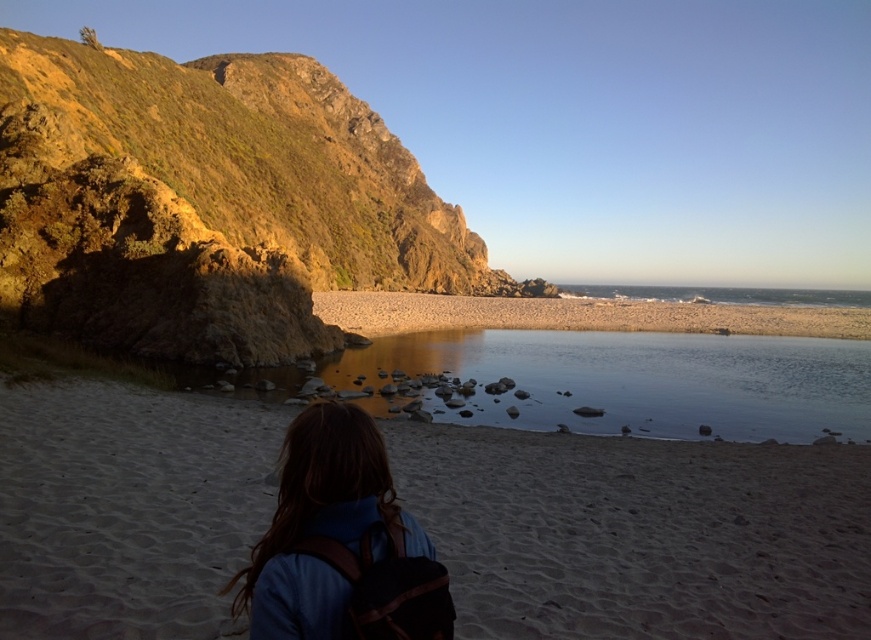
Question: Which object appears closest to the camera in this image?

Choices:
 (A) smooth reflective water at center
 (B) rustic stone cliff at left
 (C) sandy beach at lower center

Answer: (C)

Question: Does sandy beach at lower center appear on the right side of smooth reflective water at center?

Choices:
 (A) no
 (B) yes

Answer: (A)

Question: Which of the following is the farthest from the observer?

Choices:
 (A) (854, 326)
 (B) (144, 426)
 (C) (393, 262)
 (D) (363, 460)

Answer: (C)

Question: Which of these objects is positioned farthest from the rustic stone cliff at left?

Choices:
 (A) sandy beach at lower center
 (B) smooth reflective water at center

Answer: (A)

Question: Is sandy beach at lower center to the right of smooth beige sand at center from the viewer's perspective?

Choices:
 (A) no
 (B) yes

Answer: (A)

Question: Can you confirm if rustic stone cliff at left is wider than smooth beige sand at center?

Choices:
 (A) yes
 (B) no

Answer: (B)